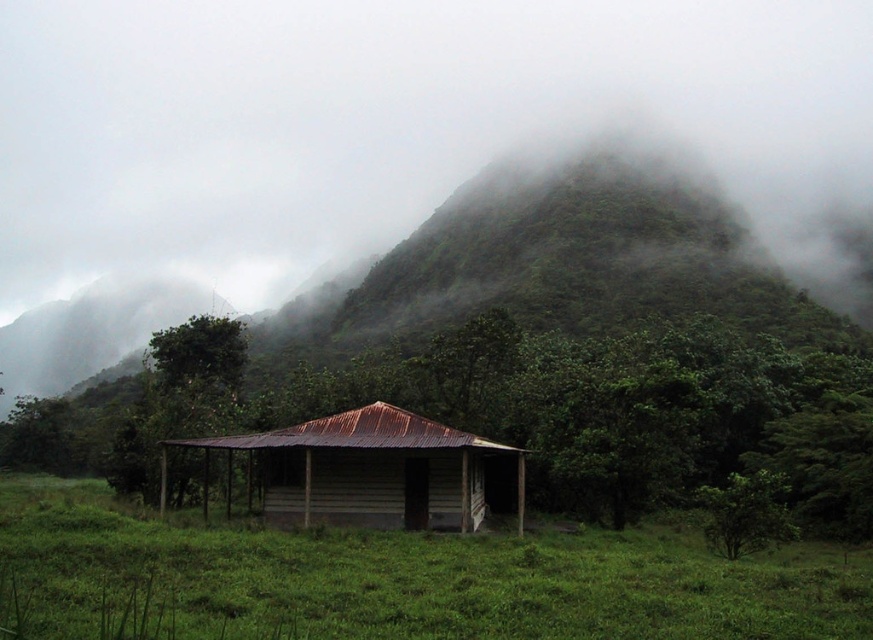
You are planning to build a small garden near the green matte mountain at center and the rusty corrugated metal cabin at center. Considering their sizes, which one would require more space between them to ensure both are visible from a distance?

The green matte mountain at center is much taller than the rusty corrugated metal cabin at center. To ensure both are visible from a distance, more space would be needed between them compared to if the mountain were smaller.

You are standing in the lush green landscape and want to place a picnic blanket. You see the green grassy at center and the rusty corrugated metal cabin at center. Which location would be more suitable for placing the picnic blanket?

The green grassy at center is positioned under the rusty corrugated metal cabin at center, so placing the picnic blanket there might be sheltered from rain but could have limited sunlight. Alternatively, the area around the cabin might offer more open space. However, based on the description, the grassy area is under the cabin, so it might be the better option for shelter.